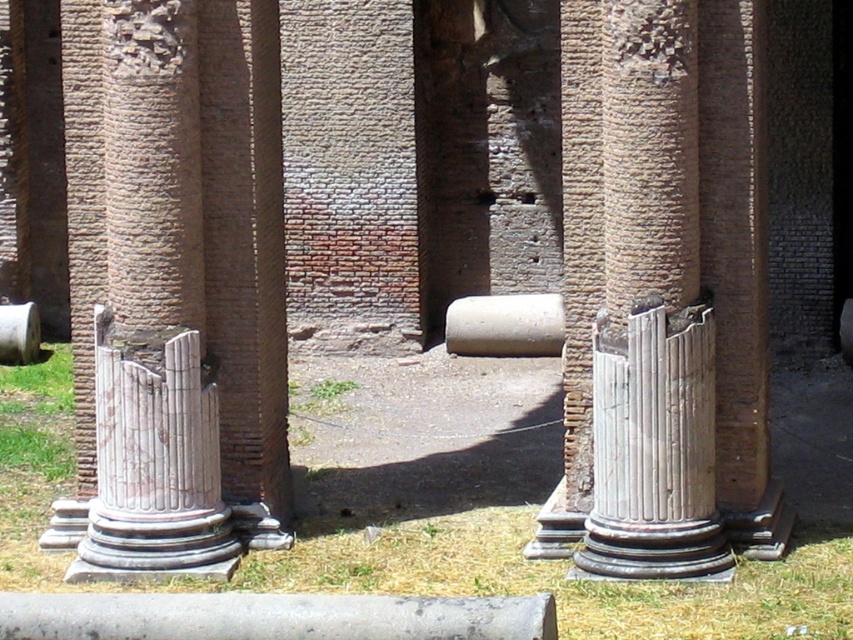
Question: Which object is closer to the camera taking this photo?

Choices:
 (A) white marble column at center
 (B) white marble column at left

Answer: (A)

Question: Which of the following is the closest to the observer?

Choices:
 (A) white marble column at center
 (B) white marble column at left

Answer: (A)

Question: In this image, where is white marble column at center located relative to white marble column at left?

Choices:
 (A) right
 (B) left

Answer: (A)

Question: Is white marble column at center to the left of white marble column at left from the viewer's perspective?

Choices:
 (A) no
 (B) yes

Answer: (A)

Question: Which point is farther to the camera?

Choices:
 (A) (671, 301)
 (B) (160, 570)

Answer: (B)

Question: Can you confirm if white marble column at center is thinner than white marble column at left?

Choices:
 (A) no
 (B) yes

Answer: (A)